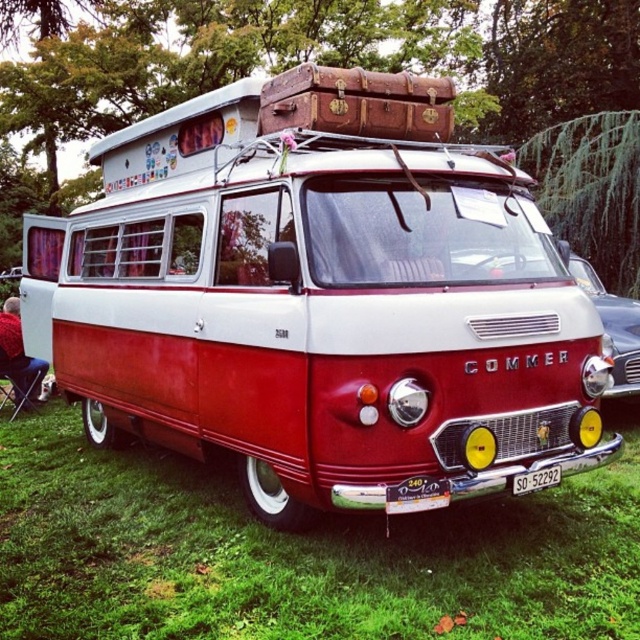
Question: Is red fabric chair at lower left positioned before white plastic license plate at center?

Choices:
 (A) yes
 (B) no

Answer: (B)

Question: Which point is farther to the camera?

Choices:
 (A) (522, 480)
 (B) (582, 260)
 (C) (124, 346)

Answer: (B)

Question: Among these points, which one is nearest to the camera?

Choices:
 (A) (516, 492)
 (B) (96, 368)
 (C) (499, 273)

Answer: (A)

Question: Is the position of matte red van at center less distant than that of red fabric chair at lower left?

Choices:
 (A) yes
 (B) no

Answer: (A)

Question: Is shiny red commer van at center bigger than red fabric chair at lower left?

Choices:
 (A) yes
 (B) no

Answer: (B)

Question: Which point is farther from the camera taking this photo?

Choices:
 (A) (12, 300)
 (B) (634, 308)
 (C) (545, 468)
 (D) (138, 316)

Answer: (A)